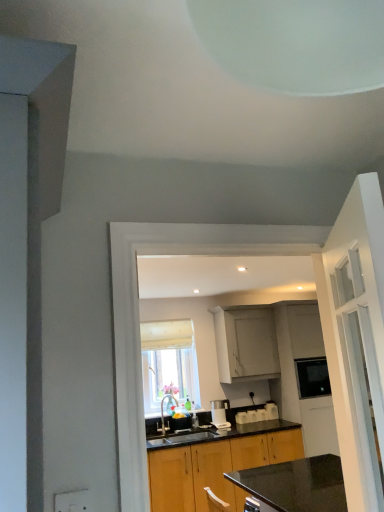
Question: From a real-world perspective, is wooden cabinet at center, the 1th cabinetry when ordered from bottom to top, above or below brushed metal faucet at center?

Choices:
 (A) below
 (B) above

Answer: (A)

Question: Looking at their shapes, would you say wooden cabinet at center, the second cabinetry from the top, is wider or thinner than brushed metal faucet at center?

Choices:
 (A) wide
 (B) thin

Answer: (A)

Question: Based on their relative distances, which object is farther from the white plastic electric outlet at lower left?

Choices:
 (A) brushed metal faucet at center
 (B) white glass door at right
 (C) white fabric window at center
 (D) wooden cabinet at center, the second cabinetry from the top
 (E) satin silver coffee machine at center

Answer: (C)

Question: Which is farther from the wooden cabinet at center, the 1th cabinetry when ordered from bottom to top?

Choices:
 (A) white fabric window at center
 (B) satin silver coffee machine at center
 (C) brushed metal faucet at center
 (D) white glass door at right
 (E) white matte cabinet at upper center, marked as the first cabinetry in a top-to-bottom arrangement

Answer: (D)